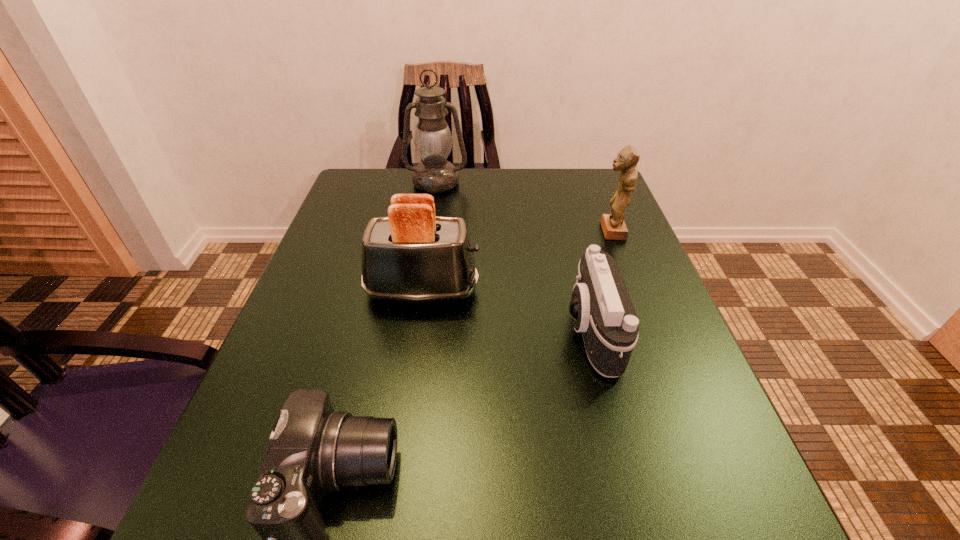
Find the location of a particular element. the farthest object is located at coordinates (432, 139).

Locate an element on the screen. The height and width of the screenshot is (540, 960). the tallest object is located at coordinates (432, 139).

This screenshot has width=960, height=540. Find the location of `figurine`. figurine is located at coordinates (614, 228).

At what (x,y) coordinates should I click in order to perform the action: click on the second farthest object. Please return your answer as a coordinate pair (x, y). Looking at the image, I should click on (614, 228).

This screenshot has width=960, height=540. What are the coordinates of `toaster` in the screenshot? It's located at (412, 255).

The width and height of the screenshot is (960, 540). Find the location of `the second shortest object`. the second shortest object is located at coordinates (601, 308).

Where is `the taller camera`? The image size is (960, 540). the taller camera is located at coordinates (601, 308).

The height and width of the screenshot is (540, 960). Find the location of `blank space located 0.140m on the left of the farthest object`. blank space located 0.140m on the left of the farthest object is located at coordinates (353, 183).

At what (x,y) coordinates should I click in order to perform the action: click on vacant region located on the front-facing side of the rightmost object. Please return your answer as a coordinate pair (x, y). This screenshot has height=540, width=960. Looking at the image, I should click on (440, 231).

This screenshot has height=540, width=960. In order to click on free space located on the front-facing side of the rightmost object in this screenshot , I will do `click(469, 231)`.